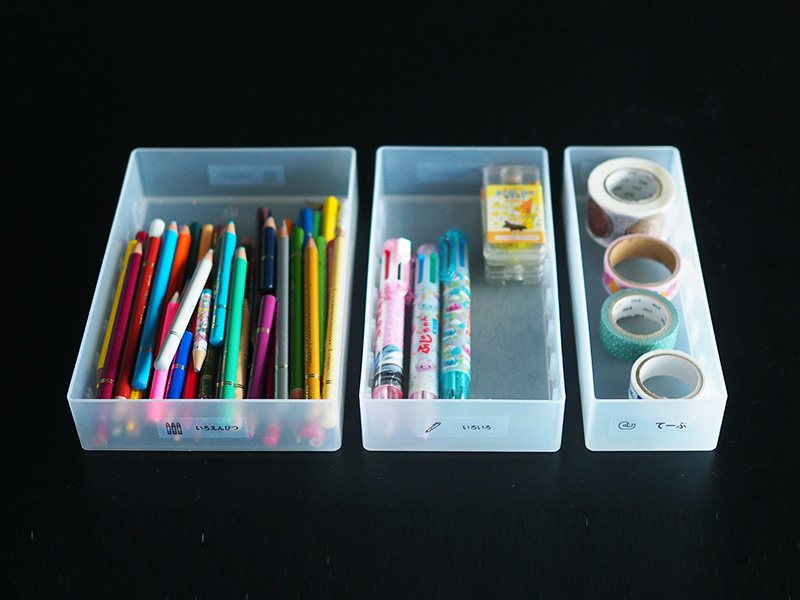
I want to click on washi tape, so (649, 365), (638, 331), (640, 262), (618, 209).